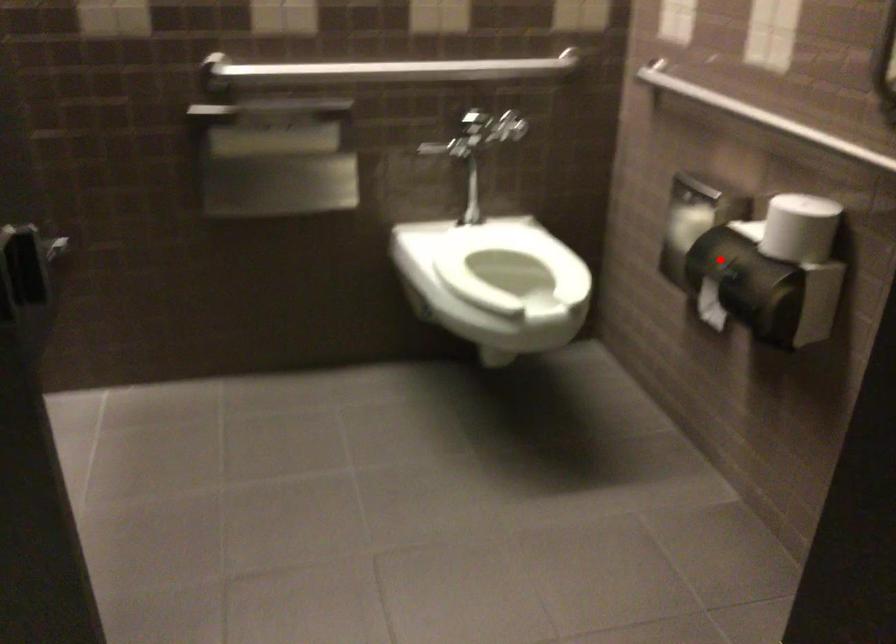
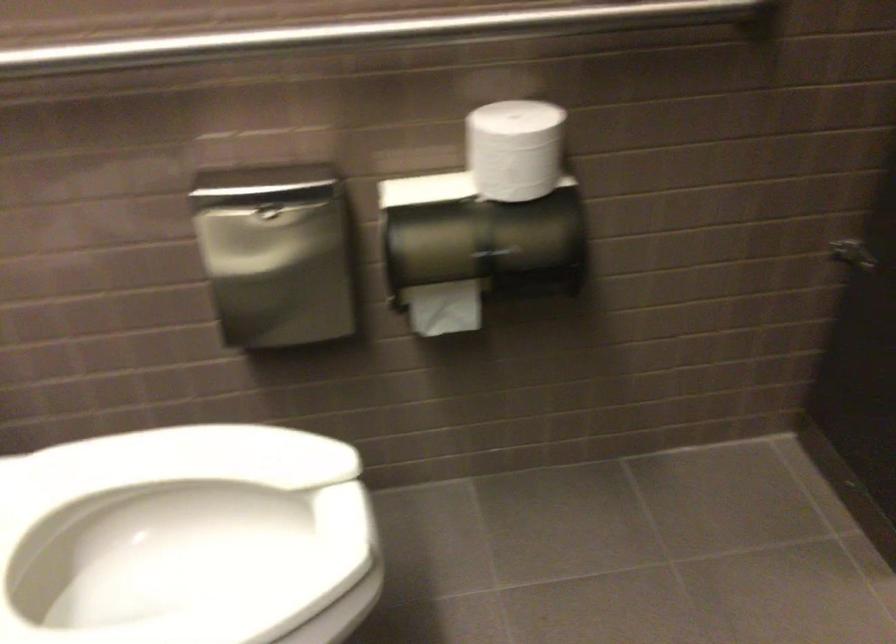
Find the pixel in the second image that matches the highlighted location in the first image.

(474, 247)